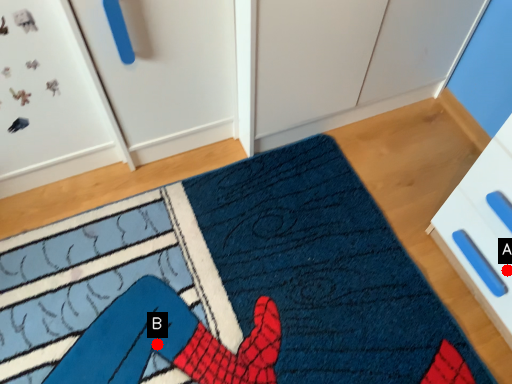
Question: Two points are circled on the image, labeled by A and B beside each circle. Which point appears farthest from the camera in this image?

Choices:
 (A) A is further
 (B) B is further

Answer: (B)